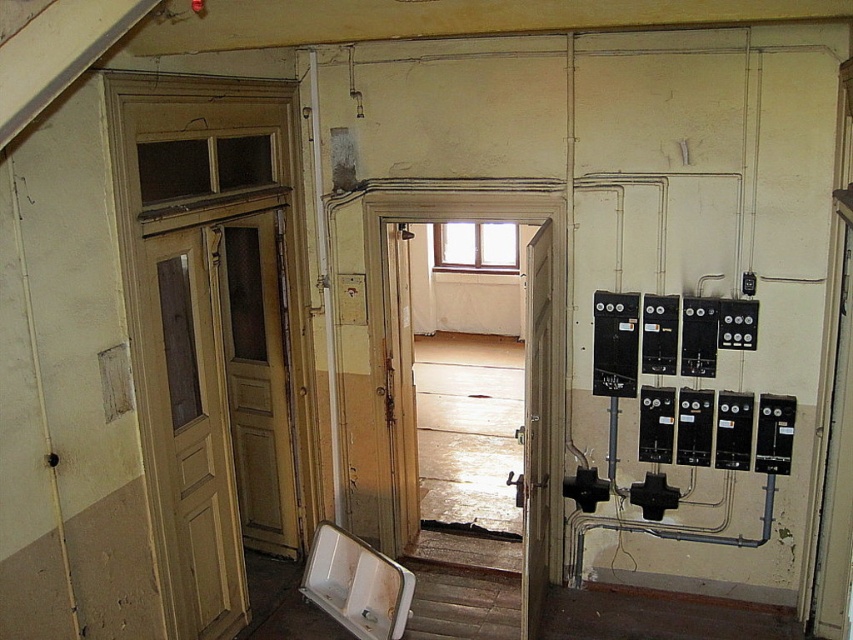
You are a maintenance worker needing to reach both the light wood paneling at left and the white matte urinal at lower center with a 30 inch long tool. Can you reach both objects with the tool without moving your position?

The distance between the light wood paneling at left and the white matte urinal at lower center is 29.31 inches, so yes, the tool can reach both objects since the distance is within the tool length of 30 inches.

You are a maintenance worker needing to replace the door handle of the matte wood door at center. The urinal is in your way. Can you reach the door handle without moving the white matte urinal at lower center?

The matte wood door at center is taller than the white matte urinal at lower center, so yes, you can reach the door handle without moving the white matte urinal at lower center.